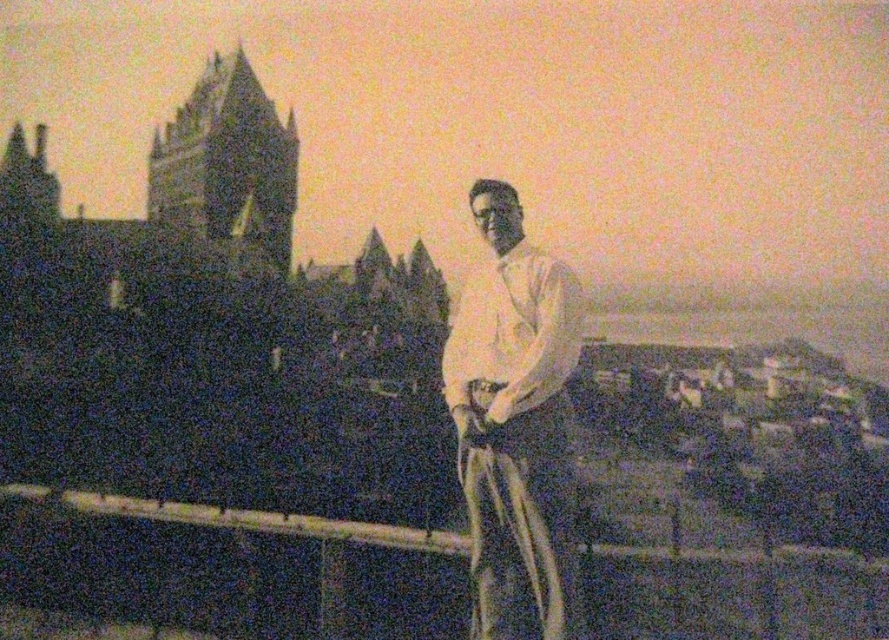
Question: Is wooden rail at center in front of white cotton shirt at center?

Choices:
 (A) no
 (B) yes

Answer: (A)

Question: Among these objects, which one is nearest to the camera?

Choices:
 (A) white cotton shirt at center
 (B) wooden rail at center

Answer: (A)

Question: Which point is farther to the camera?

Choices:
 (A) wooden rail at center
 (B) white cotton shirt at center

Answer: (A)

Question: Is wooden rail at center closer to the viewer compared to white cotton shirt at center?

Choices:
 (A) yes
 (B) no

Answer: (B)

Question: In this image, where is wooden rail at center located relative to white cotton shirt at center?

Choices:
 (A) below
 (B) above

Answer: (A)